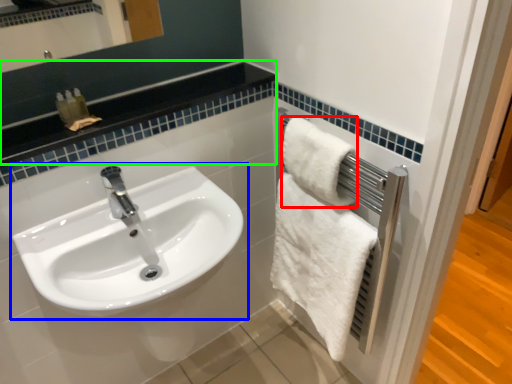
Question: Which object is the farthest from towel (highlighted by a red box)? Choose among these: sink (highlighted by a blue box) or balustrade (highlighted by a green box).

Choices:
 (A) sink
 (B) balustrade

Answer: (A)